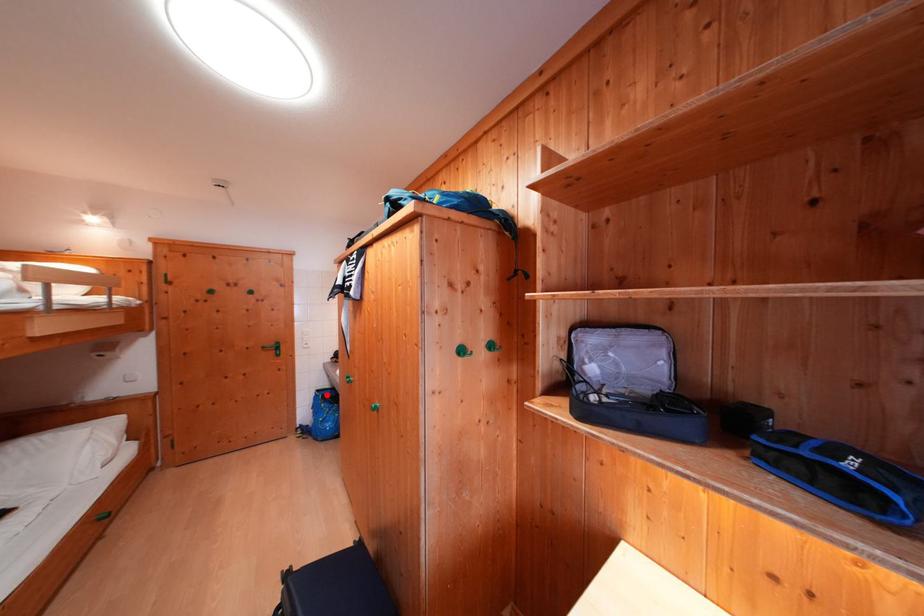
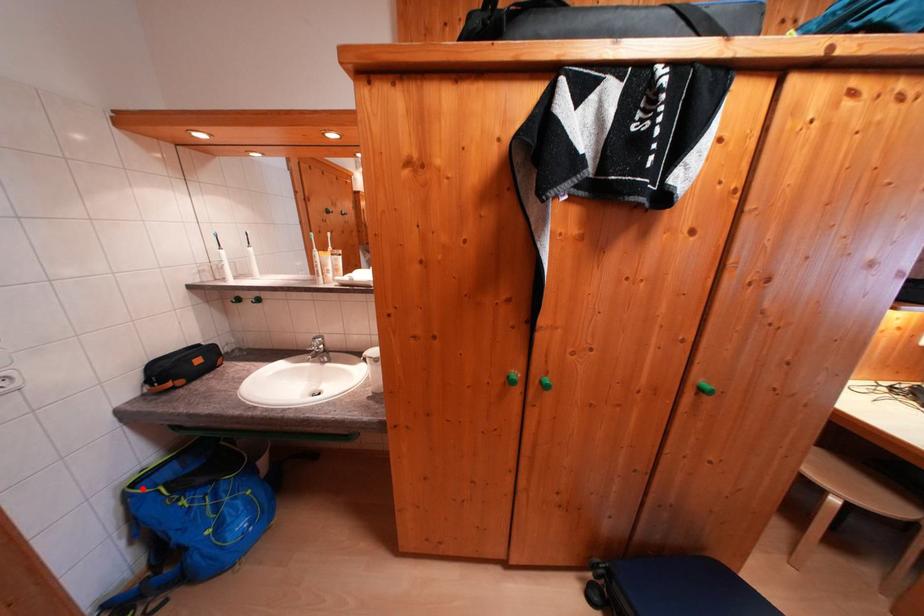
I am providing you with two images of the same scene from different viewpoints. A red point is marked on the first image and another point is marked on the second image. Is the red point in image1 aligned with the point shown in image2?

Yes